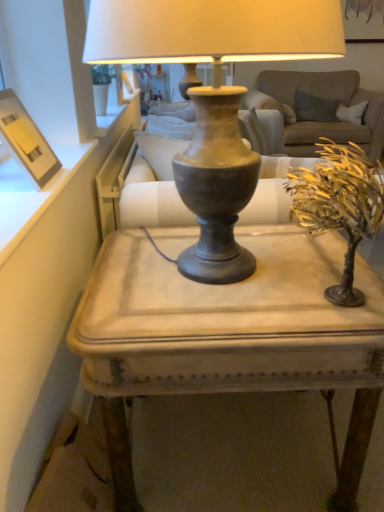
Question: Would you say matte wood picture frame at upper left is to the left or to the right of gold textured tree at right in the picture?

Choices:
 (A) right
 (B) left

Answer: (B)

Question: In terms of width, does matte wood picture frame at upper left look wider or thinner when compared to gold textured tree at right?

Choices:
 (A) thin
 (B) wide

Answer: (A)

Question: Which is nearer to the matte gray table at center?

Choices:
 (A) matte gray vase at center
 (B) matte wood picture frame at upper left
 (C) gold textured tree at right

Answer: (A)

Question: Which object is the closest to the matte gray table at center?

Choices:
 (A) matte gray vase at center
 (B) matte wood picture frame at upper left
 (C) gold textured tree at right

Answer: (A)